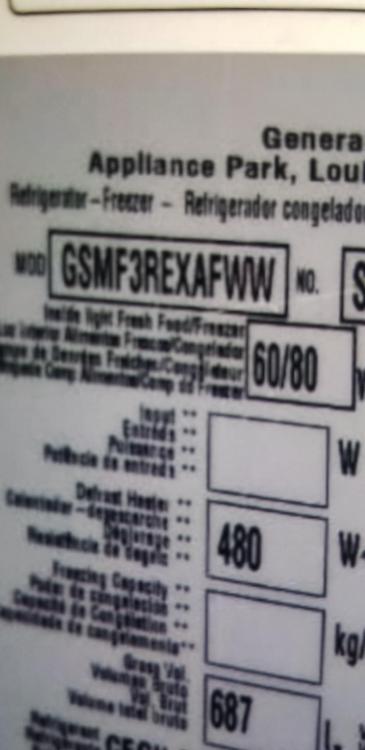
The image size is (365, 750). I want to click on says "refrigerator", so click(36, 200), click(26, 196), click(47, 196), click(64, 196).